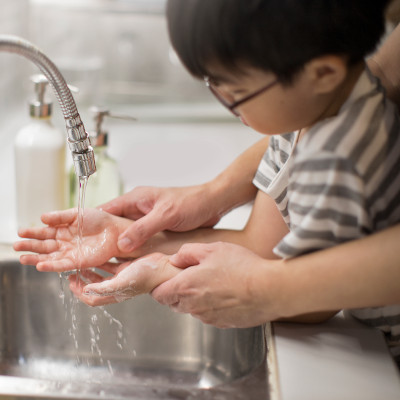
Where is `soap`? This screenshot has width=400, height=400. soap is located at coordinates (44, 138), (107, 181).